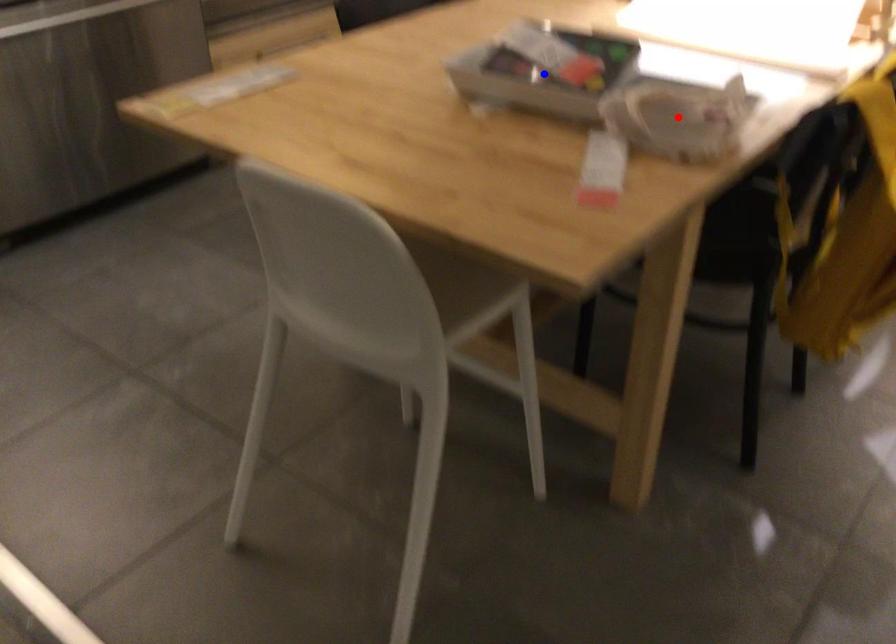
Question: Two points are marked on the image. Which point is closer to the camera?

Choices:
 (A) Blue point is closer.
 (B) Red point is closer.

Answer: (B)